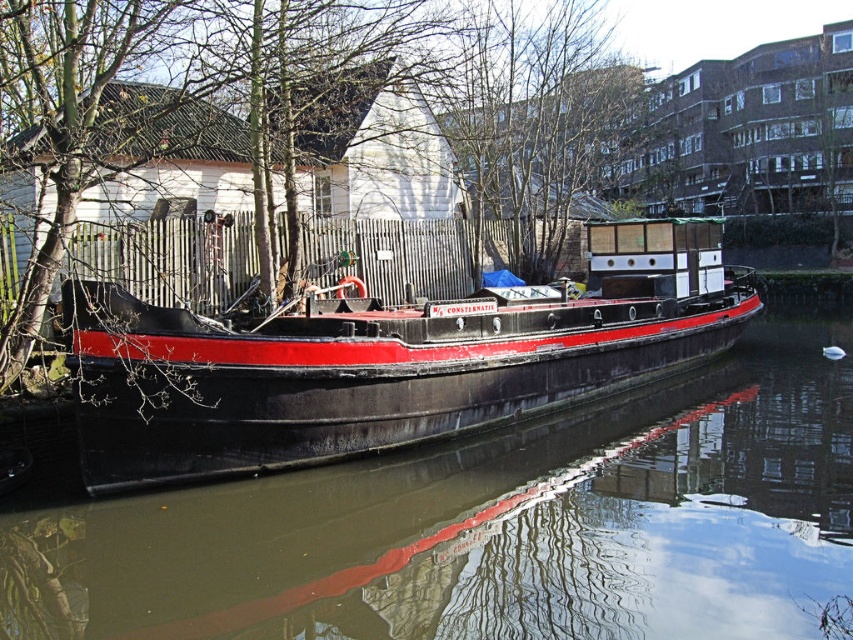
Which is above, black rubber boat at center or black matte boat at center?

Positioned higher is black matte boat at center.

Is black rubber boat at center shorter than black matte boat at center?

Correct, black rubber boat at center is not as tall as black matte boat at center.

Does point (700, 460) come behind point (251, 454)?

Yes, point (700, 460) is farther from viewer.

Where is `black rubber boat at center`? This screenshot has height=640, width=853. black rubber boat at center is located at coordinates (492, 528).